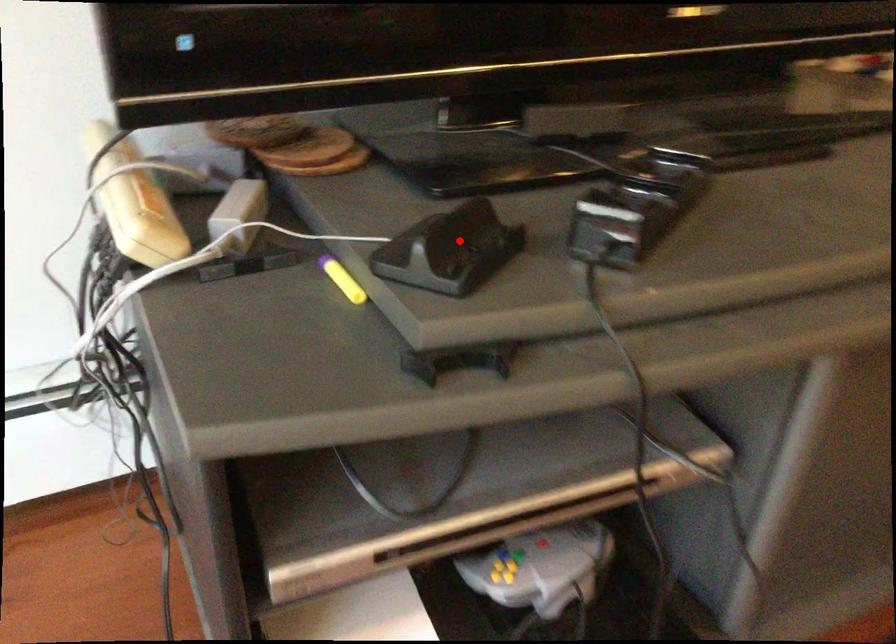
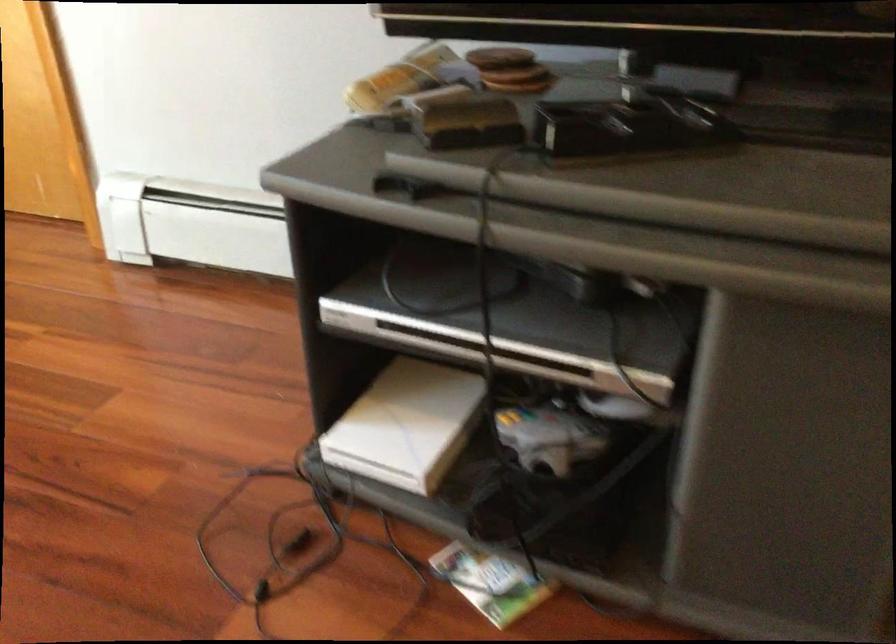
Question: I am providing you with two images of the same scene from different viewpoints. In image1, a red point is highlighted. Considering the same 3D point in image2, which of the following is correct?

Choices:
 (A) It is closer
 (B) It is farther

Answer: (B)